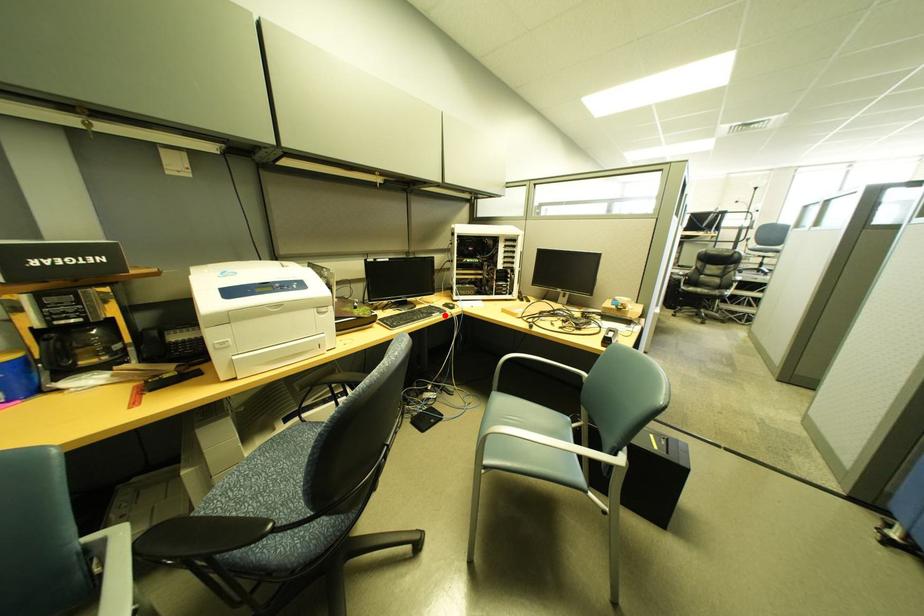
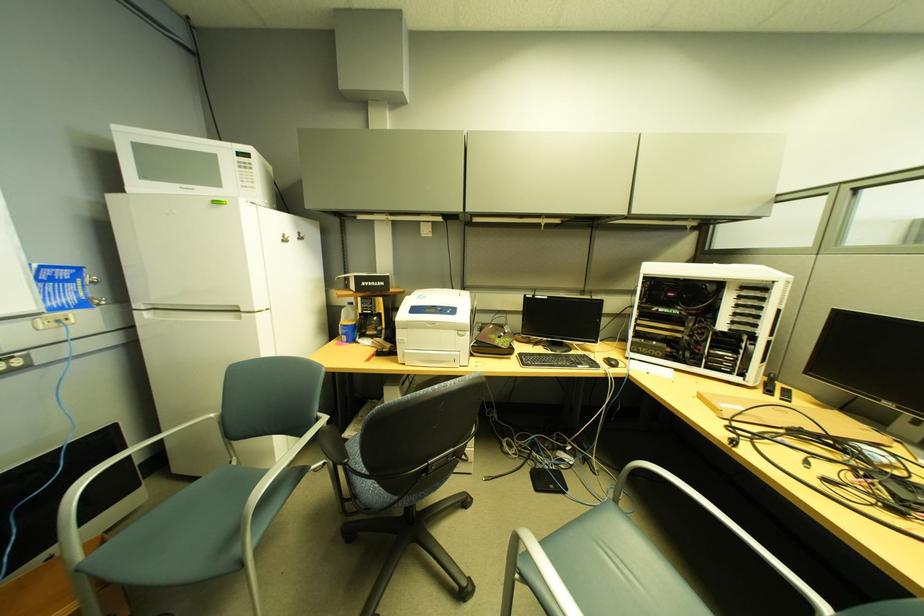
In the second image, find the point that corresponds to the highlighted location in the first image.

(592, 367)